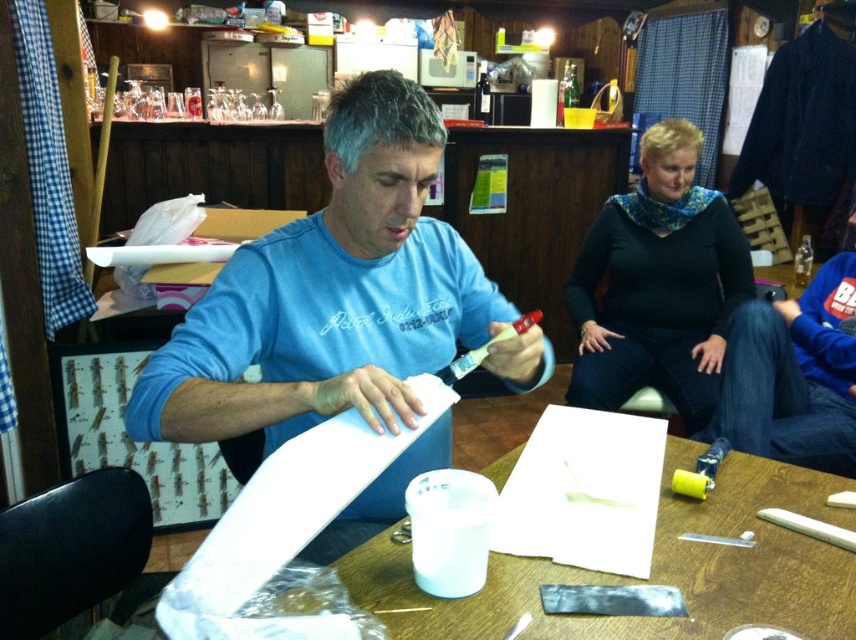
Question: Can you confirm if white paperboard at center is positioned above black matte sweater at upper right?

Choices:
 (A) yes
 (B) no

Answer: (B)

Question: Does white paperboard at center have a larger size compared to black matte sweater at upper right?

Choices:
 (A) no
 (B) yes

Answer: (A)

Question: Among these objects, which one is farthest from the camera?

Choices:
 (A) black matte sweater at upper right
 (B) white paperboard at center

Answer: (A)

Question: Does white paperboard at center appear on the right side of black matte sweater at upper right?

Choices:
 (A) yes
 (B) no

Answer: (B)

Question: Based on their relative distances, which object is nearer to the blue matte shirt at center?

Choices:
 (A) black matte sweater at upper right
 (B) white paperboard at center

Answer: (B)

Question: Which point is farther to the camera?

Choices:
 (A) black matte sweater at upper right
 (B) white paperboard at center
 (C) blue matte shirt at center

Answer: (A)